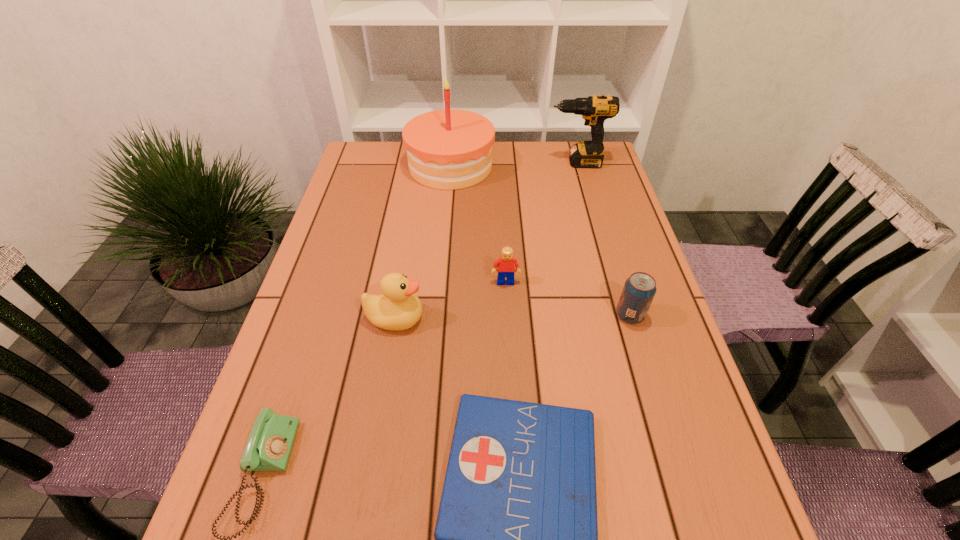
Where is `vacant region at the far left corner`? The image size is (960, 540). vacant region at the far left corner is located at coordinates (382, 157).

What are the coordinates of `vacant region between the Lego and the birthday cake` in the screenshot? It's located at (478, 224).

Where is `vacant area that lies between the pop soda and the duck`? The width and height of the screenshot is (960, 540). vacant area that lies between the pop soda and the duck is located at coordinates (513, 317).

Where is `empty space that is in between the duck and the pop soda`? empty space that is in between the duck and the pop soda is located at coordinates (513, 317).

Where is `vacant point located between the pop soda and the birthday cake`? Image resolution: width=960 pixels, height=540 pixels. vacant point located between the pop soda and the birthday cake is located at coordinates (540, 241).

Find the location of a particular element. free spot between the second tallest object and the birthday cake is located at coordinates (514, 165).

Point out which object is positioned as the nearest to the duck. Please provide its 2D coordinates. Your answer should be formatted as a tuple, i.e. [(x, y)], where the tuple contains the x and y coordinates of a point satisfying the conditions above.

[(506, 264)]

The height and width of the screenshot is (540, 960). Find the location of `object that is the sixth nearest to the birthday cake`. object that is the sixth nearest to the birthday cake is located at coordinates (268, 449).

The image size is (960, 540). What are the coordinates of `free space that satisfies the following two spatial constraints: 1. on the back side of the pop soda; 2. at the tip of the drill` in the screenshot? It's located at (584, 163).

Identify the location of vacant space that satisfies the following two spatial constraints: 1. on the front-facing side of the pop soda; 2. on the right side of the fifth nearest object. (508, 315).